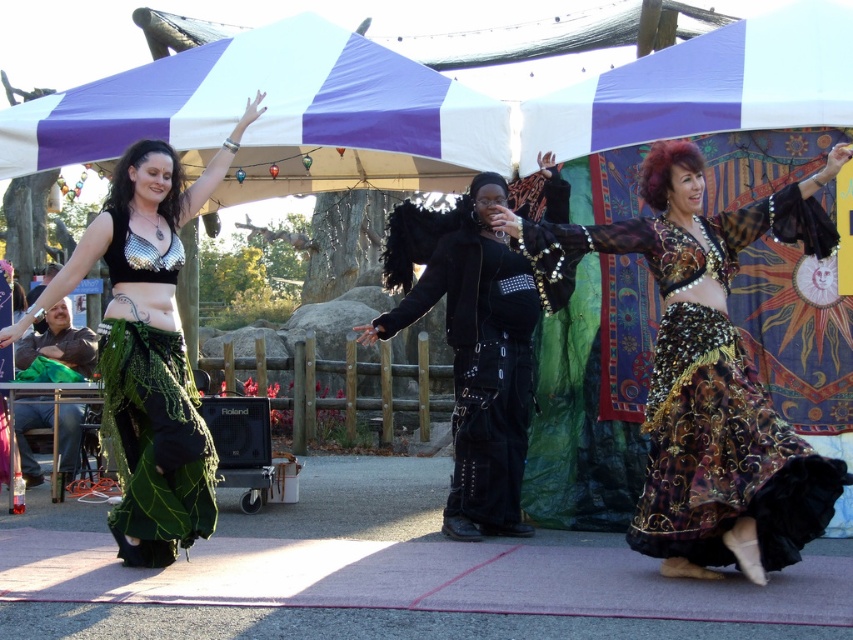
You are a photographer standing at the camera position. You want to take a closeup shot of the metallic sequined top at center. Given that you can move closer by 5 meters, will you be able to get a closer shot without exceeding the minimum focusing distance of your camera, which is 5 meters?

The metallic sequined top at center is currently 10.44 meters away from the camera. By moving closer by 5 meters, the new distance would be 5.44 meters, which is still above the camera minimum focusing distance of 5 meters. Therefore, you can get a closer shot.

You are a photographer at the event and need to capture a photo of both the metallic sequined top at center and the metallic mesh bikini top at center. Which one should you focus on first if you want to ensure both are in frame without moving the camera?

You should focus on the metallic sequined top at center first since it is positioned on the left side of the metallic mesh bikini top at center, so capturing it first ensures both are in frame without needing to adjust the camera position.